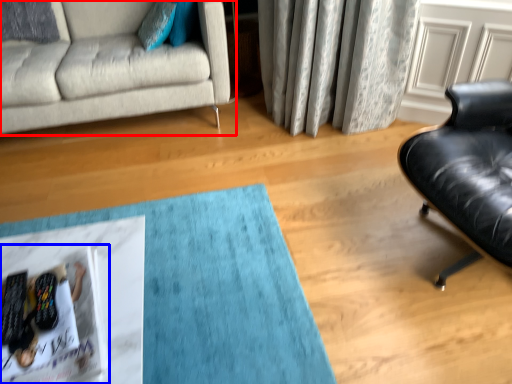
Question: Which point is further to the camera, studio couch (highlighted by a red box) or magazine (highlighted by a blue box)?

Choices:
 (A) studio couch
 (B) magazine

Answer: (A)